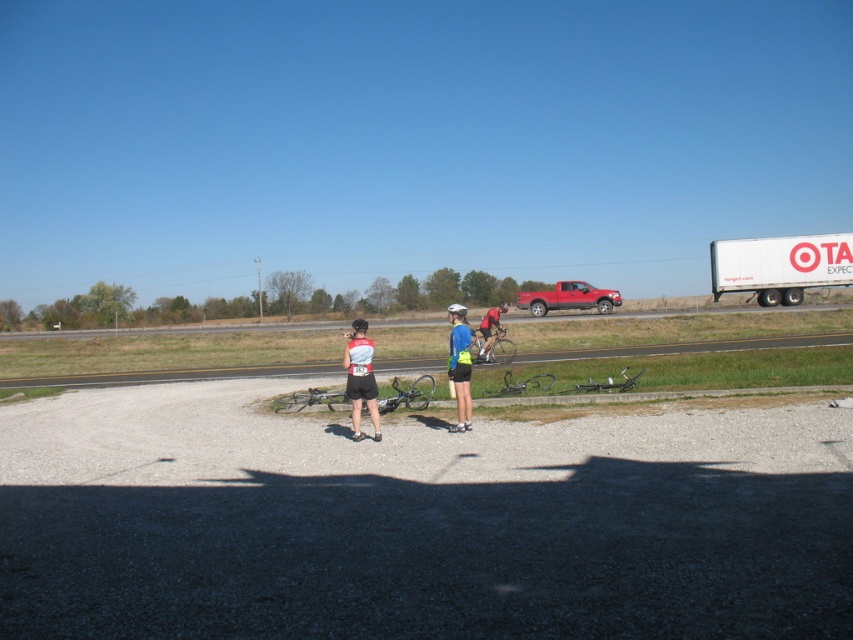
Which is behind, point (358, 364) or point (462, 321)?

Point (462, 321)

Is white and red athletic jersey at center to the right of blue fabric shirt at center from the viewer's perspective?

Incorrect, white and red athletic jersey at center is not on the right side of blue fabric shirt at center.

Who is more distant from viewer, (360, 404) or (457, 408)?

The point (457, 408) is behind.

The height and width of the screenshot is (640, 853). What are the coordinates of `white and red athletic jersey at center` in the screenshot? It's located at (360, 378).

Is asphalt road at center wider than blue fabric shirt at center?

Indeed, asphalt road at center has a greater width compared to blue fabric shirt at center.

Between point (399, 360) and point (459, 349), which one is positioned behind?

Point (399, 360)

The image size is (853, 640). Find the location of `asphalt road at center`. asphalt road at center is located at coordinates (177, 374).

Who is positioned more to the left, blue fabric shirt at center or white matte bicycle helmet at center?

blue fabric shirt at center is more to the left.

Which is below, blue fabric shirt at center or white matte bicycle helmet at center?

blue fabric shirt at center is lower down.

Which is behind, point (451, 369) or point (461, 305)?

Point (461, 305)

Image resolution: width=853 pixels, height=640 pixels. Identify the location of blue fabric shirt at center. pyautogui.click(x=460, y=365).